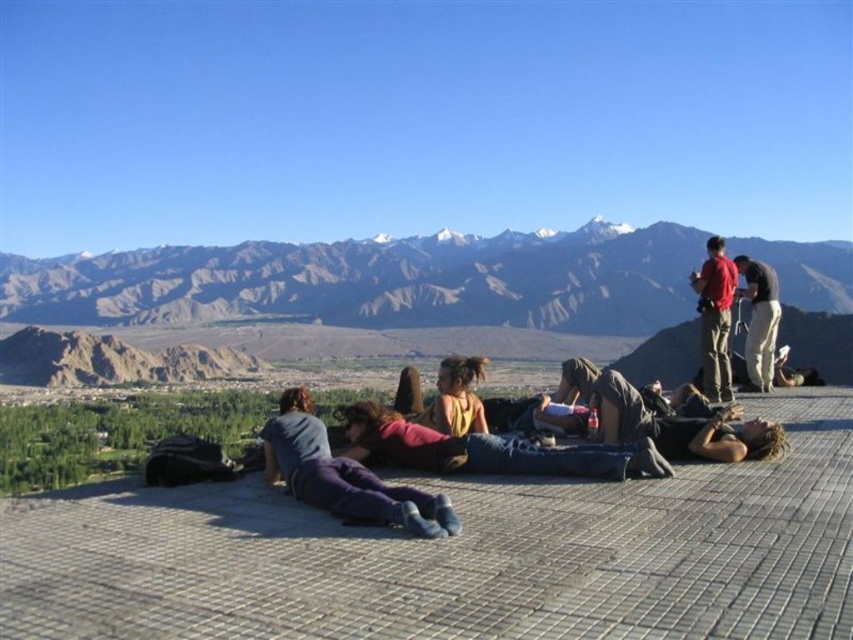
Question: Does rugged brown mountains at upper center have a larger size compared to purple cotton pants at center?

Choices:
 (A) no
 (B) yes

Answer: (B)

Question: Estimate the real-world distances between objects in this image. Which object is farther from the dark brown hair at center?

Choices:
 (A) purple cotton pants at center
 (B) yellow fabric at center
 (C) denim jeans at center
 (D) matte red shirt at upper right

Answer: (A)

Question: Which object appears farthest from the camera in this image?

Choices:
 (A) purple cotton pants at center
 (B) rugged brown mountains at upper center
 (C) denim jeans at center

Answer: (B)

Question: Which object is closer to the camera taking this photo?

Choices:
 (A) yellow fabric at center
 (B) rugged brown mountains at upper center
 (C) purple cotton pants at center
 (D) dark brown hair at center

Answer: (C)

Question: Is dark brown hair at center to the left of matte red shirt at upper right from the viewer's perspective?

Choices:
 (A) no
 (B) yes

Answer: (B)

Question: Where is yellow fabric at center located in relation to matte red shirt at upper right in the image?

Choices:
 (A) left
 (B) right

Answer: (A)